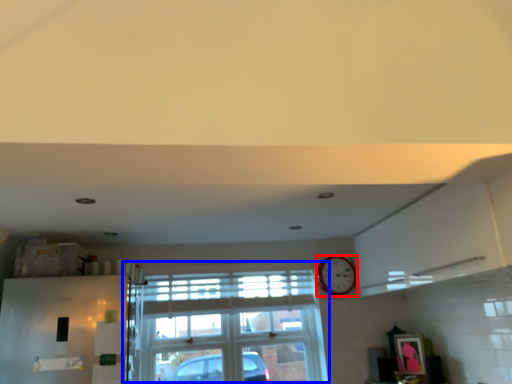
Question: Which object is further to the camera taking this photo, clock (highlighted by a red box) or window (highlighted by a blue box)?

Choices:
 (A) clock
 (B) window

Answer: (A)